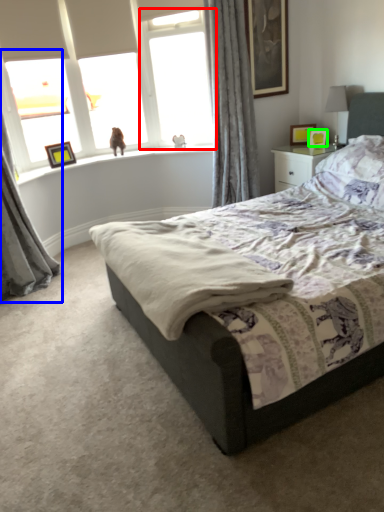
Question: Estimate the real-world distances between objects in this image. Which object is farther from window screen (highlighted by a red box), curtain (highlighted by a blue box) or picture frame (highlighted by a green box)?

Choices:
 (A) curtain
 (B) picture frame

Answer: (A)